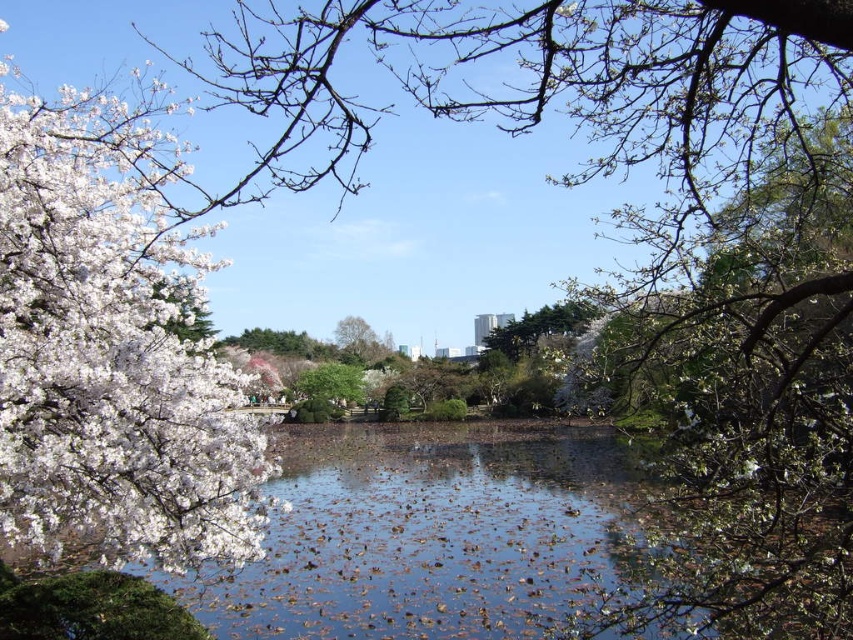
You are standing in the park and see a point marked at coordinates [112,349]. What object is located at that point?

The white matte flower at left is located at point [112,349].

Looking at this image, you are a gardener standing in the park and want to water the white matte flower at left and the green leafy tree at center. Which one is closer to you?

The white matte flower at left is closer to you because it is positioned under the green leafy tree at center, meaning it is nearer to your viewpoint.